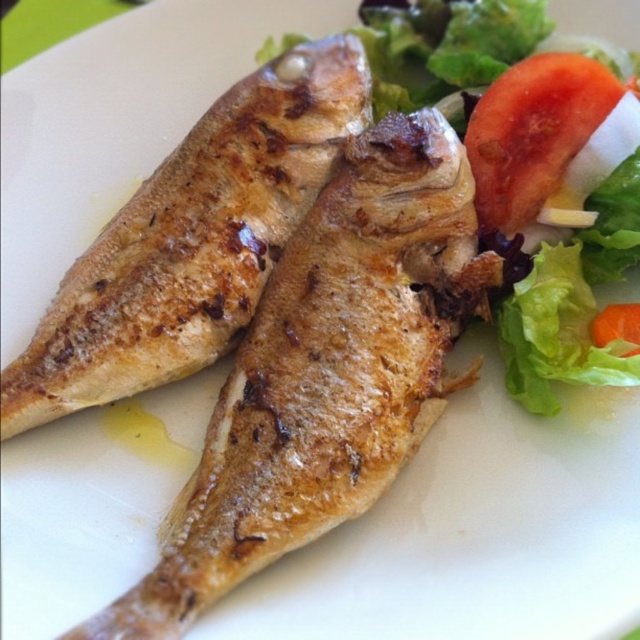
You are a chef arranging a salad on a plate. You have a red matte tomato at upper right and an orange smooth carrot at upper right. If you need to place them exactly 12 inches apart for presentation, are they currently spaced correctly?

The red matte tomato at upper right and orange smooth carrot at upper right are 11.24 inches apart from each other, so they are not exactly 12 inches apart. They need to be moved slightly farther apart to meet the required distance.